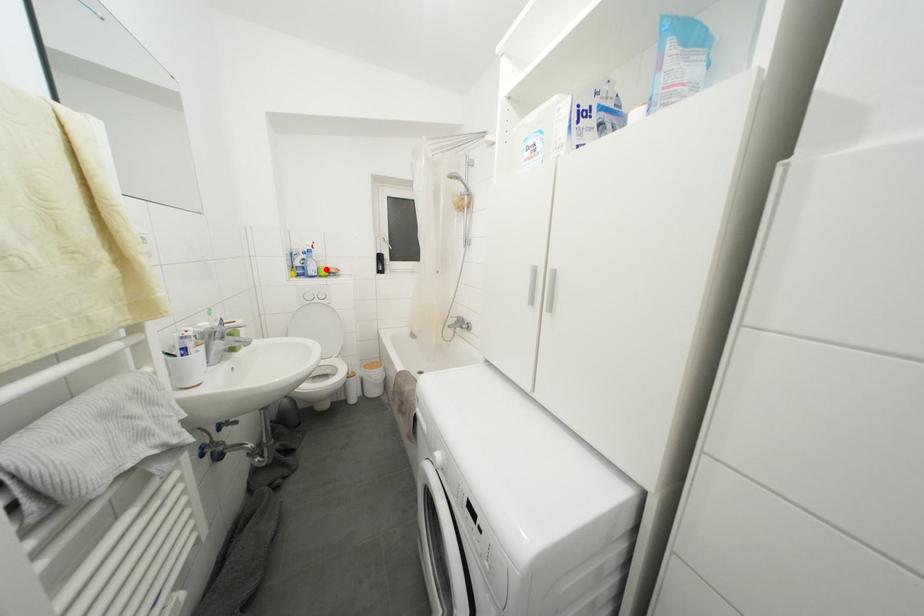
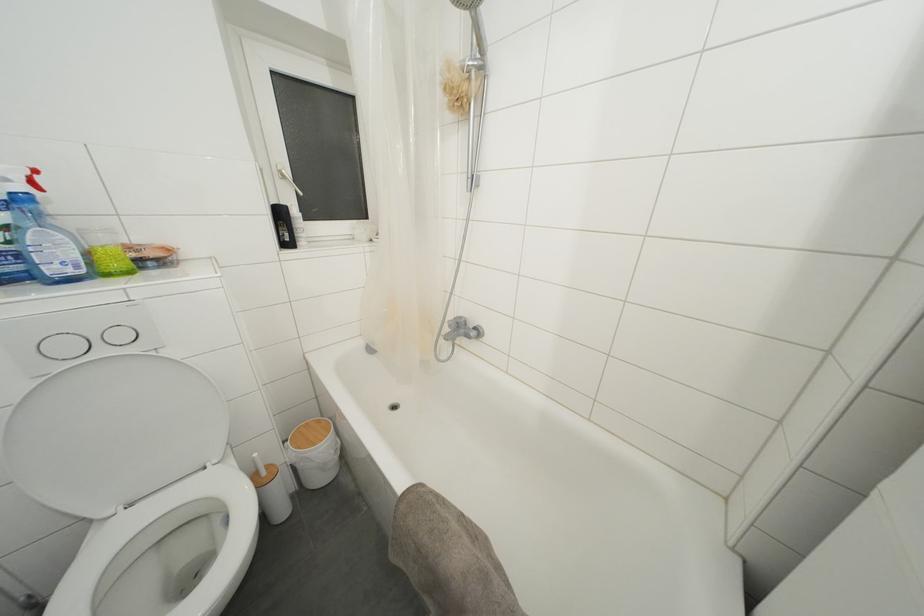
Question: I am providing you with two images of the same scene from different viewpoints. Given a red point in image1, look at the same physical point in image2. Is it:

Choices:
 (A) Closer to the viewpoint
 (B) Farther from the viewpoint

Answer: (B)